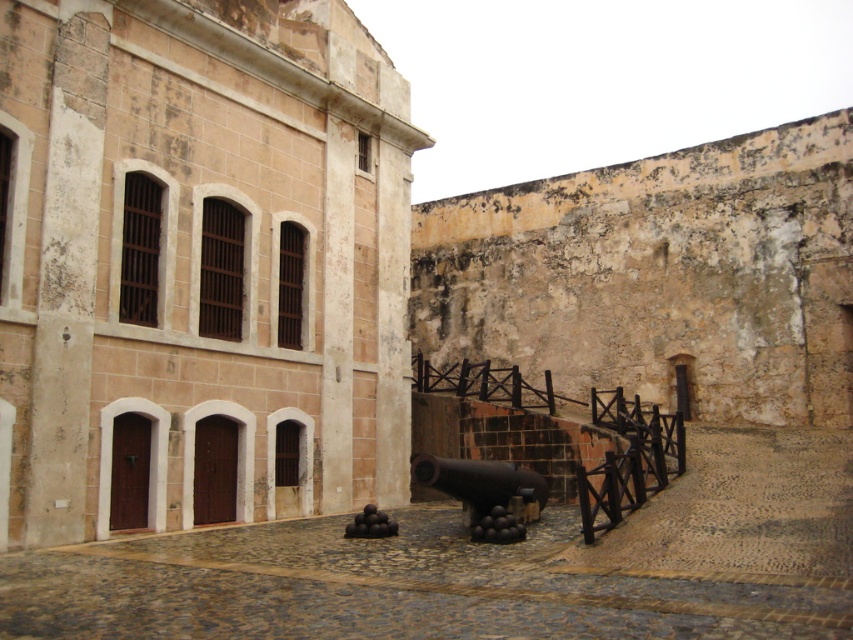
Can you confirm if matte stone building at center is positioned above black matte cannon at center?

Yes, matte stone building at center is above black matte cannon at center.

Can you confirm if matte stone building at center is positioned to the left of black matte cannon at center?

Indeed, matte stone building at center is positioned on the left side of black matte cannon at center.

Is point (115, 362) in front of point (448, 464)?

No, (115, 362) is behind (448, 464).

The width and height of the screenshot is (853, 640). I want to click on matte stone building at center, so (x=198, y=264).